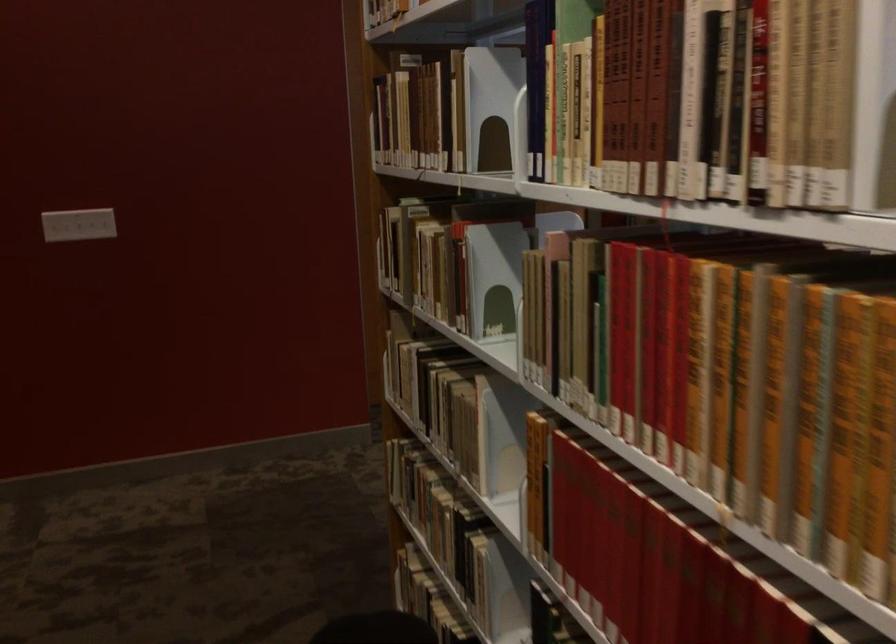
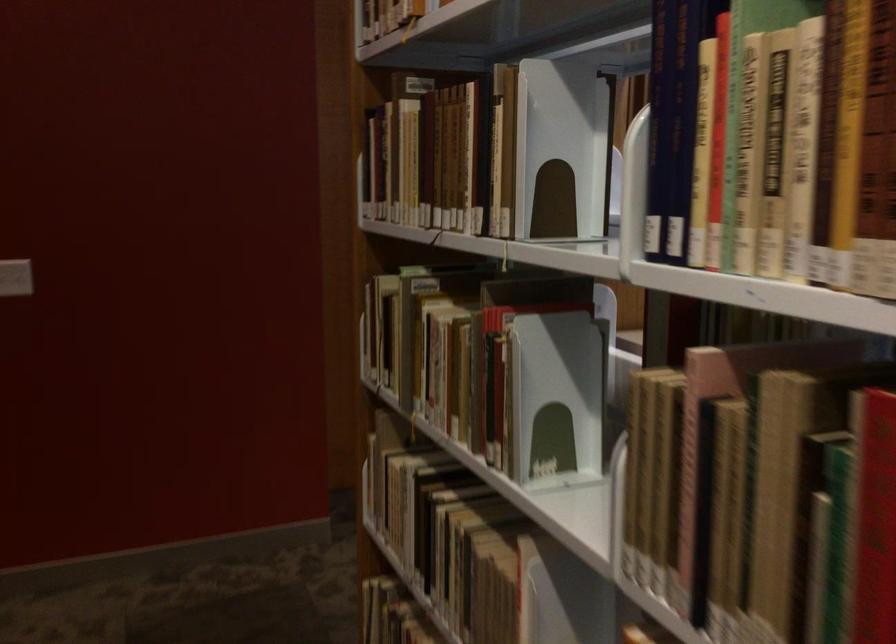
Question: I am providing you with two images of the same scene from different viewpoints. Please identify which objects are invisible in image2.

Choices:
 (A) light switch
 (B) hardcover book
 (C) white bookend
 (D) none of these

Answer: (D)